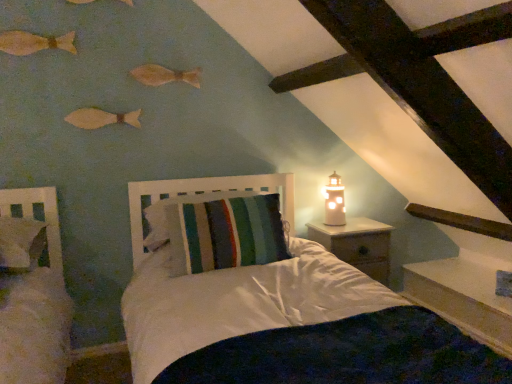
I want to click on free space to the right of metallic gold lighthouse at right, so click(362, 227).